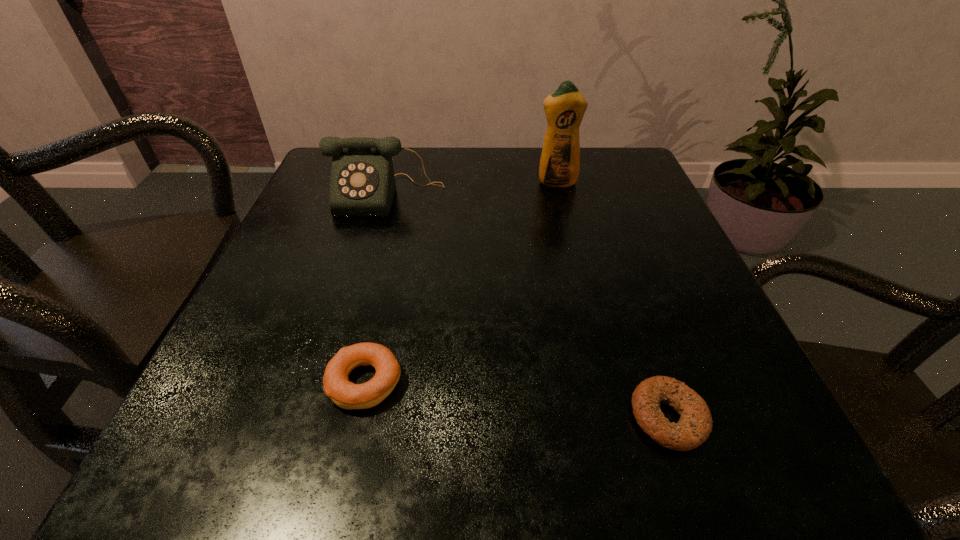
I want to click on object located at the left edge, so click(362, 183).

Identify the location of detergent that is positioned at the right edge. The width and height of the screenshot is (960, 540). (560, 160).

Identify the location of bagel present at the right edge. This screenshot has height=540, width=960. (695, 424).

At what (x,y) coordinates should I click in order to perform the action: click on object present at the far left corner. Please return your answer as a coordinate pair (x, y). Image resolution: width=960 pixels, height=540 pixels. Looking at the image, I should click on (362, 183).

Where is `object that is positioned at the far right corner`? The image size is (960, 540). object that is positioned at the far right corner is located at coordinates (560, 160).

The height and width of the screenshot is (540, 960). In order to click on object present at the near right corner in this screenshot , I will do `click(695, 424)`.

In the image, there is a desktop. Identify the location of vacant space at the far edge. The image size is (960, 540). (459, 165).

Find the location of a particular element. The height and width of the screenshot is (540, 960). free space at the near edge of the desktop is located at coordinates [540, 445].

At what (x,y) coordinates should I click in order to perform the action: click on blank space at the left edge of the desktop. Please return your answer as a coordinate pair (x, y). Looking at the image, I should click on (309, 204).

Locate an element on the screen. free location at the right edge is located at coordinates (620, 326).